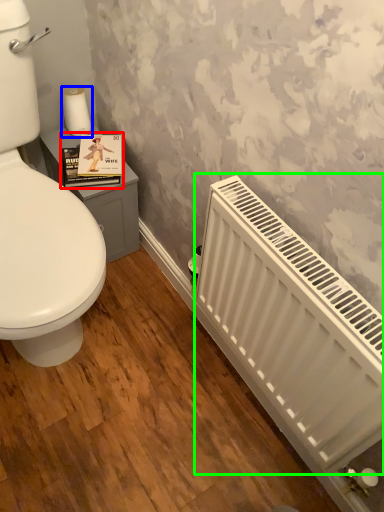
Question: Considering the real-world distances, which object is farthest from book cover (highlighted by a red box)? toilet paper (highlighted by a blue box) or radiator (highlighted by a green box)?

Choices:
 (A) toilet paper
 (B) radiator

Answer: (B)